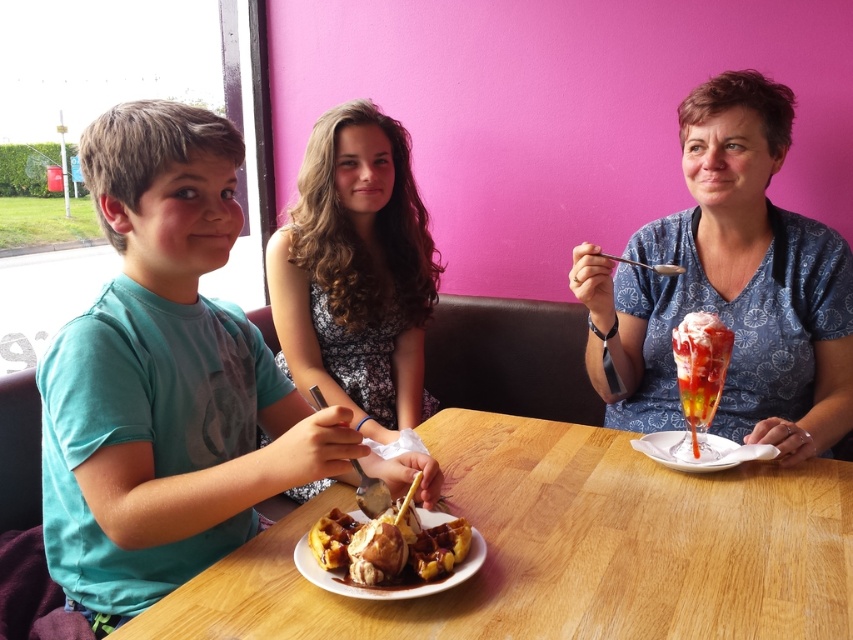
Question: Can you confirm if wooden table at center is positioned above translucent glass parfait at right?

Choices:
 (A) yes
 (B) no

Answer: (B)

Question: Is dark brown textured dress at center to the left of white glossy plate at lower right from the viewer's perspective?

Choices:
 (A) no
 (B) yes

Answer: (B)

Question: Which point is closer to the camera?

Choices:
 (A) (96, 376)
 (B) (651, 449)
 (C) (399, 145)
 (D) (463, 536)

Answer: (A)

Question: Which point is closer to the camera?

Choices:
 (A) blue printed dress at center
 (B) wooden table at center
 (C) golden brown waffle with syrup at center

Answer: (B)

Question: Which object is closer to the camera taking this photo?

Choices:
 (A) teal matte shirt at left
 (B) white glossy plate at lower right

Answer: (A)

Question: Does wooden table at center appear over blue printed dress at center?

Choices:
 (A) yes
 (B) no

Answer: (B)